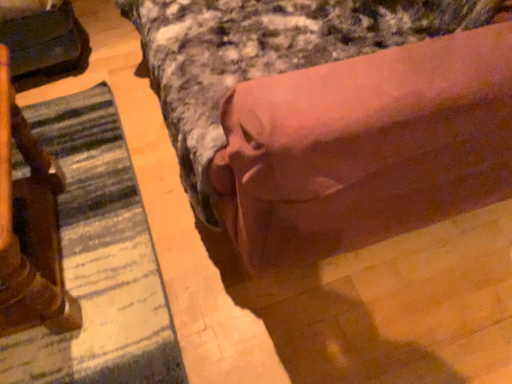
Question: Is brown fabric bed at center not inside matte black swivel chair at left?

Choices:
 (A) no
 (B) yes

Answer: (B)

Question: Is brown fabric bed at center shorter than matte black swivel chair at left?

Choices:
 (A) no
 (B) yes

Answer: (A)

Question: From the image's perspective, is brown fabric bed at center on matte black swivel chair at left?

Choices:
 (A) no
 (B) yes

Answer: (A)

Question: Could you tell me if brown fabric bed at center is turned towards matte black swivel chair at left?

Choices:
 (A) no
 (B) yes

Answer: (B)

Question: From the image's perspective, would you say brown fabric bed at center is shown under matte black swivel chair at left?

Choices:
 (A) no
 (B) yes

Answer: (B)

Question: Looking at their shapes, would you say brown fabric bed at center is wider or thinner than striped fabric mat at lower left?

Choices:
 (A) wide
 (B) thin

Answer: (A)

Question: In terms of size, does brown fabric bed at center appear bigger or smaller than striped fabric mat at lower left?

Choices:
 (A) big
 (B) small

Answer: (A)

Question: From the image's perspective, relative to striped fabric mat at lower left, is brown fabric bed at center above or below?

Choices:
 (A) below
 (B) above

Answer: (B)

Question: Is brown fabric bed at center spatially inside striped fabric mat at lower left, or outside of it?

Choices:
 (A) outside
 (B) inside

Answer: (A)

Question: Relative to wooden statue at left, is brown fabric bed at center in front or behind?

Choices:
 (A) behind
 (B) front

Answer: (B)

Question: From the image's perspective, relative to wooden statue at left, is brown fabric bed at center above or below?

Choices:
 (A) below
 (B) above

Answer: (B)

Question: From a real-world perspective, relative to wooden statue at left, is brown fabric bed at center vertically above or below?

Choices:
 (A) below
 (B) above

Answer: (B)

Question: Considering the positions of point (410, 193) and point (28, 226), is point (410, 193) closer or farther from the camera than point (28, 226)?

Choices:
 (A) closer
 (B) farther

Answer: (A)

Question: Based on their positions, is striped fabric mat at lower left located to the left or right of wooden statue at left?

Choices:
 (A) right
 (B) left

Answer: (A)

Question: Does point (120, 145) appear closer or farther from the camera than point (2, 92)?

Choices:
 (A) farther
 (B) closer

Answer: (A)